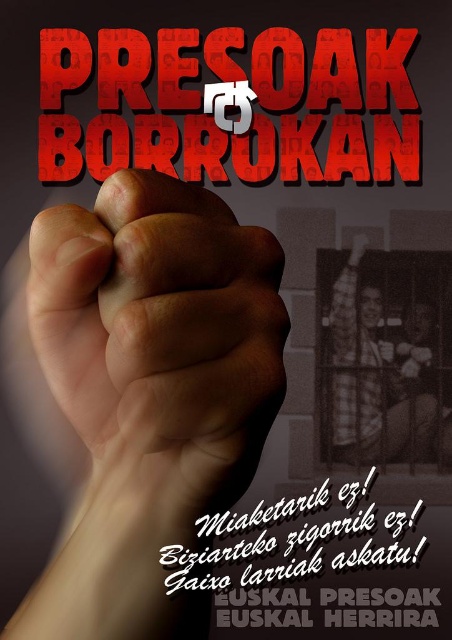
Question: Which of the following is the closest to the observer?

Choices:
 (A) red textured paper at center
 (B) smooth skin fist at center

Answer: (B)

Question: Among these objects, which one is farthest from the camera?

Choices:
 (A) plaid fabric shirt at center
 (B) red textured paper at center

Answer: (A)

Question: Among these points, which one is nearest to the camera?

Choices:
 (A) [x=212, y=115]
 (B) [x=367, y=326]
 (C) [x=224, y=419]

Answer: (C)

Question: Can you confirm if smooth skin fist at center is bigger than plaid fabric shirt at center?

Choices:
 (A) no
 (B) yes

Answer: (A)

Question: Can you confirm if white paper text at center is positioned to the left of plaid fabric shirt at center?

Choices:
 (A) yes
 (B) no

Answer: (A)

Question: Is smooth skin fist at center to the right of red textured paper at center from the viewer's perspective?

Choices:
 (A) yes
 (B) no

Answer: (B)